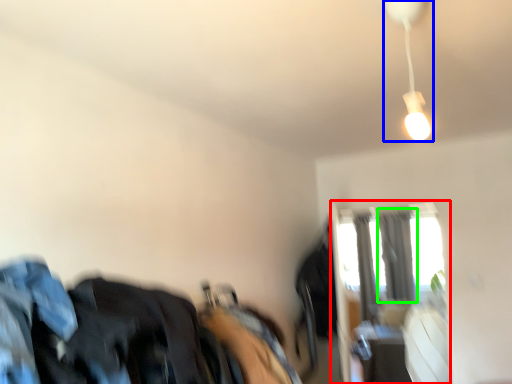
Question: Which object is the farthest from window (highlighted by a red box)? Choose among these: lamp (highlighted by a blue box) or curtain (highlighted by a green box).

Choices:
 (A) lamp
 (B) curtain

Answer: (A)